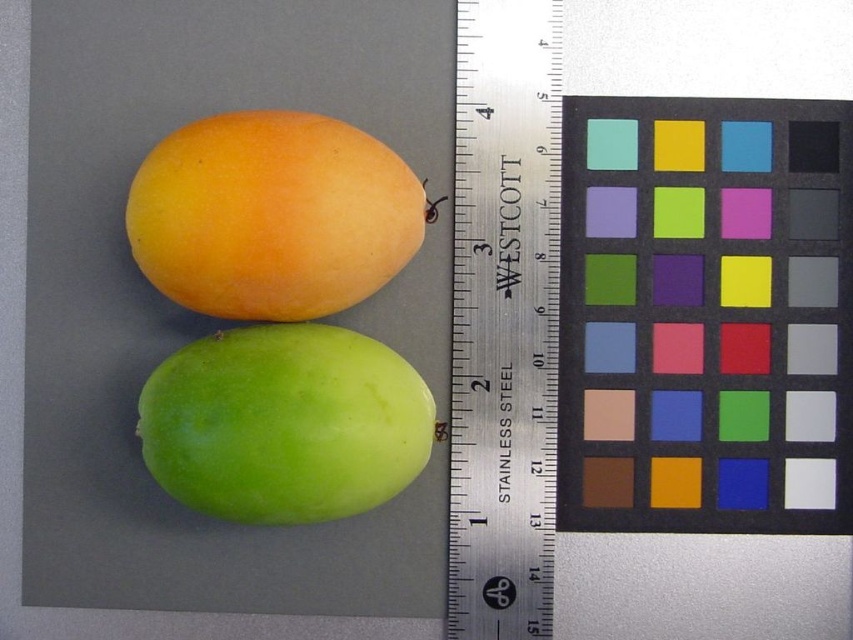
Between stainless steel ruler at center and matte orange mango at upper left, which one is positioned lower?

stainless steel ruler at center is below.

Is stainless steel ruler at center shorter than matte orange mango at upper left?

No.

Where is `stainless steel ruler at center`? This screenshot has height=640, width=853. stainless steel ruler at center is located at coordinates (503, 320).

Is matte black square at upper right taller than matte orange mango at upper left?

Yes.

Is point (791, 484) positioned after point (315, 221)?

That is True.

What do you see at coordinates (705, 316) in the screenshot? This screenshot has width=853, height=640. I see `matte black square at upper right` at bounding box center [705, 316].

Image resolution: width=853 pixels, height=640 pixels. I want to click on matte black square at upper right, so click(x=705, y=316).

Is point (805, 497) closer to viewer compared to point (492, 83)?

That is True.

Describe the element at coordinates (705, 316) in the screenshot. I see `matte black square at upper right` at that location.

Locate an element on the screen. The height and width of the screenshot is (640, 853). matte black square at upper right is located at coordinates (705, 316).